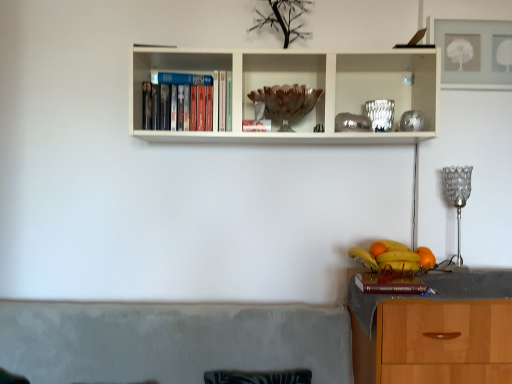
Question: Would you say brown wooden bowl at center is outside silver metallic lamp at right?

Choices:
 (A) yes
 (B) no

Answer: (A)

Question: Is brown wooden bowl at center thinner than silver metallic lamp at right?

Choices:
 (A) yes
 (B) no

Answer: (B)

Question: Considering the relative sizes of brown wooden bowl at center and silver metallic lamp at right in the image provided, is brown wooden bowl at center bigger than silver metallic lamp at right?

Choices:
 (A) yes
 (B) no

Answer: (A)

Question: Does brown wooden bowl at center appear on the right side of silver metallic lamp at right?

Choices:
 (A) yes
 (B) no

Answer: (B)

Question: Does brown wooden bowl at center have a smaller size compared to silver metallic lamp at right?

Choices:
 (A) no
 (B) yes

Answer: (A)

Question: Is hardcover book at lower right bigger or smaller than silver metallic lamp at right?

Choices:
 (A) small
 (B) big

Answer: (A)

Question: Which is correct: hardcover book at lower right is inside silver metallic lamp at right, or outside of it?

Choices:
 (A) inside
 (B) outside

Answer: (B)

Question: Considering the positions of point click(x=386, y=284) and point click(x=454, y=185), is point click(x=386, y=284) closer or farther from the camera than point click(x=454, y=185)?

Choices:
 (A) farther
 (B) closer

Answer: (B)

Question: From the image's perspective, is hardcover book at lower right positioned above or below silver metallic lamp at right?

Choices:
 (A) above
 (B) below

Answer: (B)

Question: Based on their sizes in the image, would you say orange matte at right, the 2th orange positioned from the back, is bigger or smaller than orange matte at right, which appears as the 1th orange when viewed from the back?

Choices:
 (A) big
 (B) small

Answer: (A)

Question: Which is correct: orange matte at right, the 2th orange positioned from the back, is inside orange matte at right, the second orange in the right-to-left sequence, or outside of it?

Choices:
 (A) inside
 (B) outside

Answer: (B)

Question: From their relative heights in the image, would you say orange matte at right, the 2th orange positioned from the back, is taller or shorter than orange matte at right, arranged as the second orange when viewed from the front?

Choices:
 (A) short
 (B) tall

Answer: (B)

Question: From the image's perspective, is orange matte at right, the 1th orange from the right, located above or below orange matte at right, the second orange in the right-to-left sequence?

Choices:
 (A) below
 (B) above

Answer: (A)

Question: From a real-world perspective, is hardcover book at lower right physically located above or below orange matte at right, which is the first orange in front-to-back order?

Choices:
 (A) below
 (B) above

Answer: (A)

Question: From the image's perspective, is hardcover book at lower right above or below orange matte at right, arranged as the second orange when viewed from the left?

Choices:
 (A) below
 (B) above

Answer: (A)